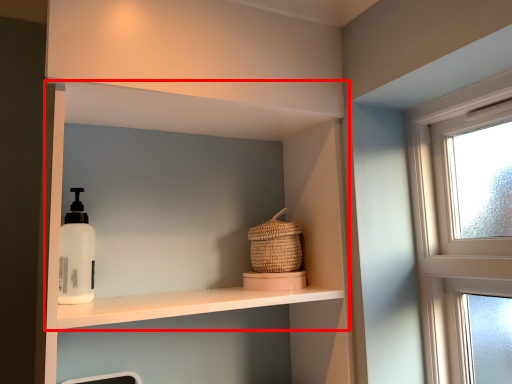
Question: From the image's perspective, what is the correct spatial positioning of shelf (annotated by the red box) in reference to basket?

Choices:
 (A) below
 (B) above

Answer: (A)